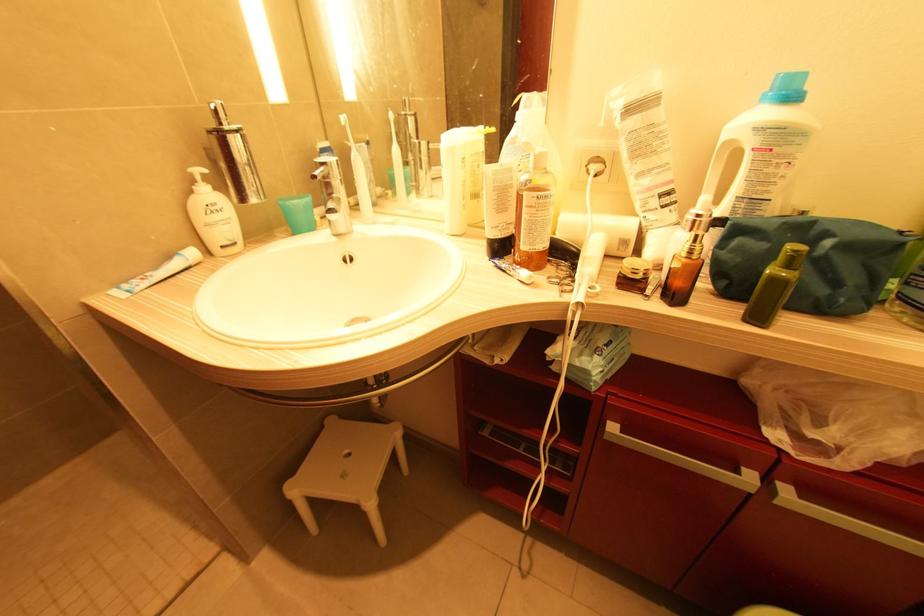
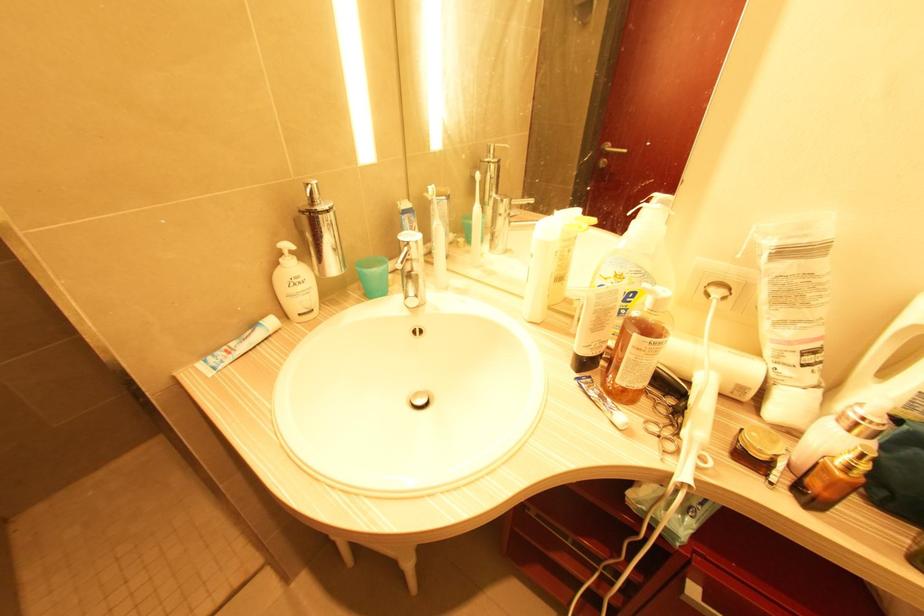
Locate, in the second image, the point that corresponds to (x=625, y=244) in the first image.

(743, 390)